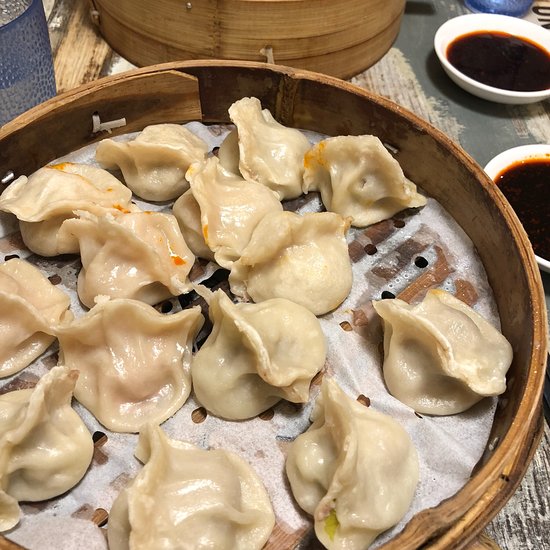
At what (x,y) coordinates should I click in order to perform the action: click on cup. Please return your answer as a coordinate pair (x, y). The image size is (550, 550). Looking at the image, I should click on (36, 79).